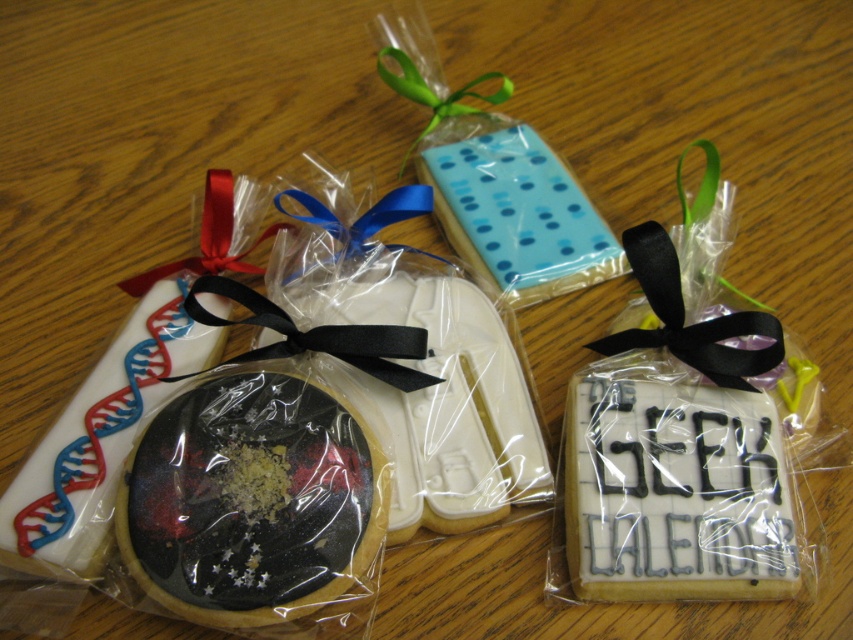
The width and height of the screenshot is (853, 640). What do you see at coordinates (253, 502) in the screenshot? I see `glittery galaxy cookie at center` at bounding box center [253, 502].

Who is lower down, glittery galaxy cookie at center or red satin ribbon at center?

glittery galaxy cookie at center is below.

Which is in front, point (316, 394) or point (225, 244)?

Point (316, 394) is in front.

The image size is (853, 640). I want to click on glittery galaxy cookie at center, so click(x=253, y=502).